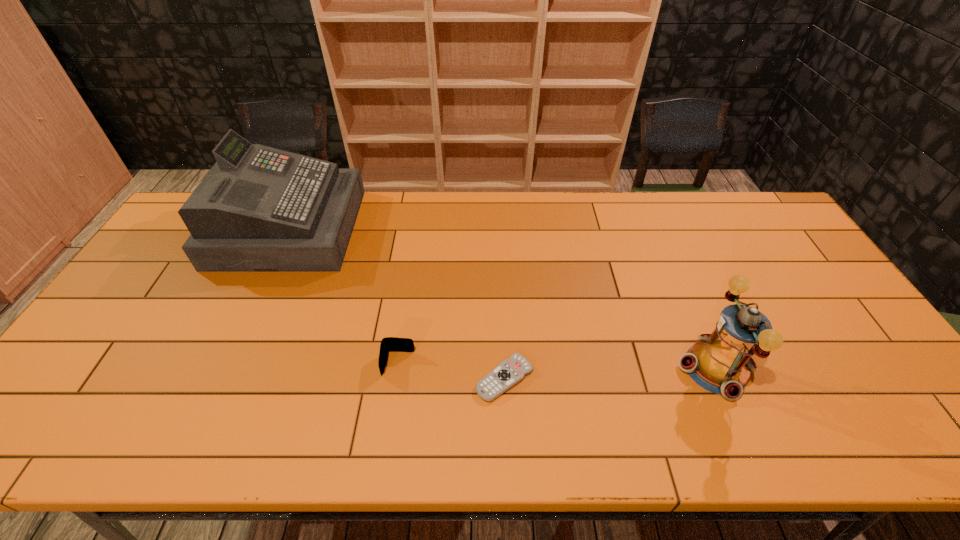
Locate an element on the screen. Image resolution: width=960 pixels, height=540 pixels. the leftmost object is located at coordinates (259, 209).

What are the coordinates of `the farthest object` in the screenshot? It's located at (259, 209).

Find the location of a particular element. The width and height of the screenshot is (960, 540). the rightmost object is located at coordinates (721, 362).

I want to click on wallet, so click(x=388, y=344).

This screenshot has height=540, width=960. I want to click on the second shortest object, so pos(388,344).

What are the coordinates of `remote control` in the screenshot? It's located at (508, 373).

This screenshot has height=540, width=960. In order to click on the second object from right to left in this screenshot , I will do `click(508, 373)`.

Locate an element on the screen. Image resolution: width=960 pixels, height=540 pixels. vacant space located 0.110m on the front-facing side of the cash register is located at coordinates (387, 228).

Identify the location of vacant space located on the front-facing side of the rightmost object. (580, 368).

At what (x,y) coordinates should I click in order to perform the action: click on free location located on the front-facing side of the rightmost object. Please return your answer as a coordinate pair (x, y). Looking at the image, I should click on (552, 368).